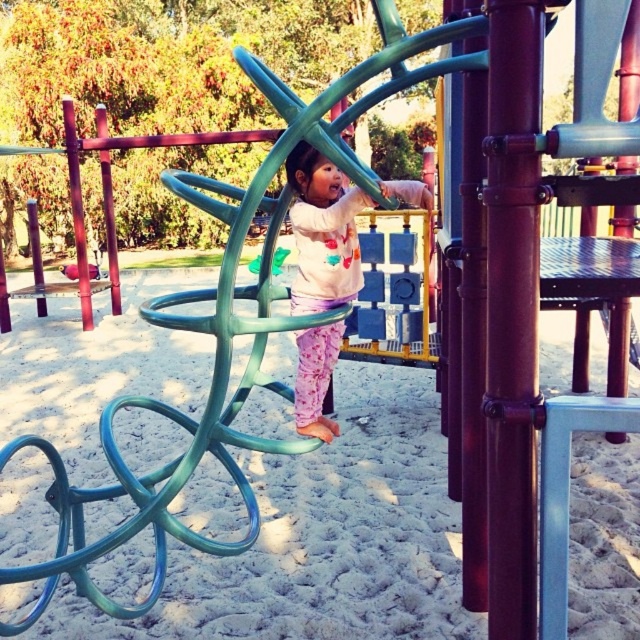
Question: Is white sand at center smaller than pastel pink fabric pants at center?

Choices:
 (A) yes
 (B) no

Answer: (A)

Question: Which object is farther from the camera taking this photo?

Choices:
 (A) pastel pink fabric pants at center
 (B) white sand at center

Answer: (B)

Question: Can you confirm if white sand at center is smaller than pastel pink fabric pants at center?

Choices:
 (A) no
 (B) yes

Answer: (B)

Question: Which object is farther from the camera taking this photo?

Choices:
 (A) white sand at center
 (B) pastel pink fabric pants at center

Answer: (A)

Question: Does white sand at center appear under pastel pink fabric pants at center?

Choices:
 (A) no
 (B) yes

Answer: (B)

Question: Which point appears closest to the camera in this image?

Choices:
 (A) (330, 196)
 (B) (195, 403)

Answer: (A)